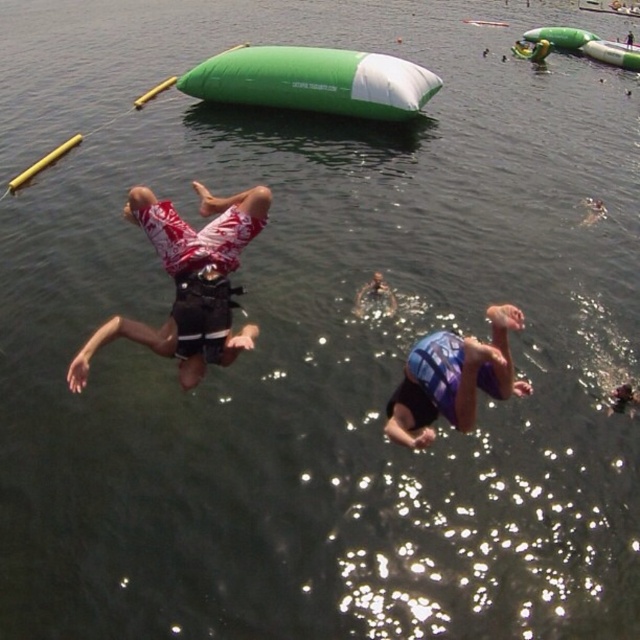
You are a lifeguard assessing the scene. You see the printed cotton shorts at center and the blue textured life vest at center. Which object is shorter in height?

The printed cotton shorts at center is shorter in height compared to the blue textured life vest at center as stated in the description.